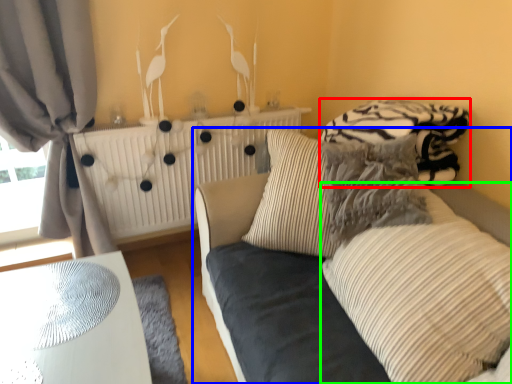
Question: Which object is positioned closest to bedding (highlighted by a red box)? Select from studio couch (highlighted by a blue box) and pillow (highlighted by a green box).

Choices:
 (A) studio couch
 (B) pillow

Answer: (A)